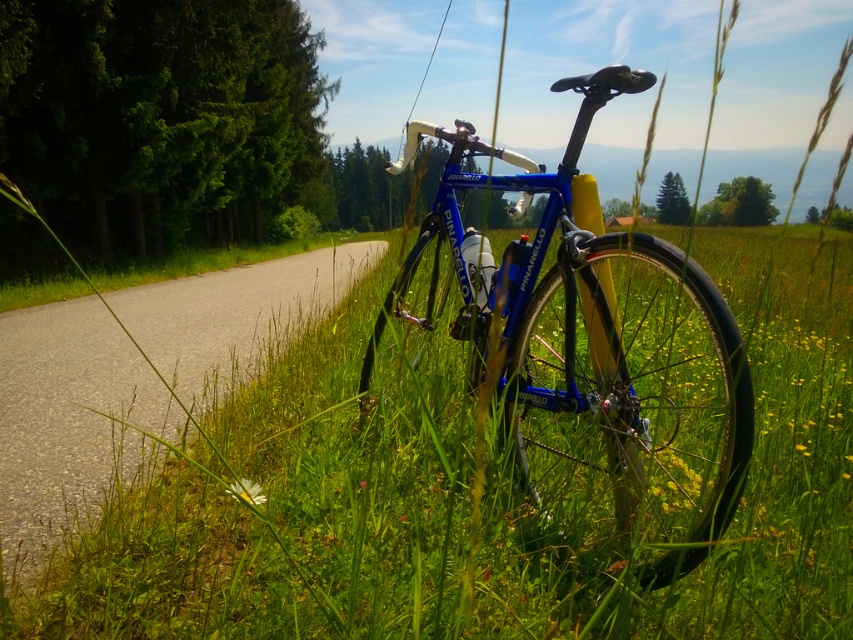
Is blue metallic bicycle at center positioned in front of asphalt road at center?

Yes, blue metallic bicycle at center is closer to the viewer.

Does blue metallic bicycle at center appear under asphalt road at center?

No.

The height and width of the screenshot is (640, 853). Find the location of `blue metallic bicycle at center`. blue metallic bicycle at center is located at coordinates (593, 364).